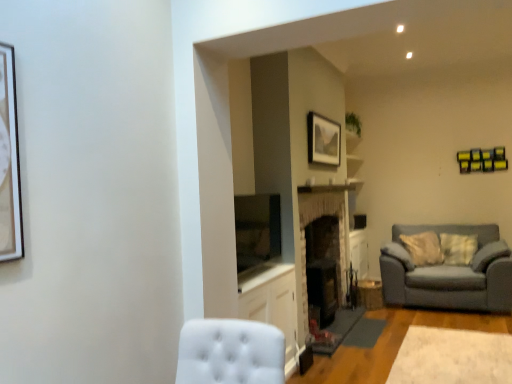
In order to face brick fireplace at center, which is the second fireplace from back to front, should I rotate leftwards or rightwards?

Turn right by 8.550 degrees to look at brick fireplace at center, which is the second fireplace from back to front.

Image resolution: width=512 pixels, height=384 pixels. What do you see at coordinates (272, 304) in the screenshot? I see `white glossy cabinet at center` at bounding box center [272, 304].

This screenshot has width=512, height=384. What do you see at coordinates (323, 140) in the screenshot? I see `matte wooden picture frame at upper center` at bounding box center [323, 140].

What do you see at coordinates (323, 266) in the screenshot? I see `dark stone fireplace at center, placed as the 2th fireplace when sorted from front to back` at bounding box center [323, 266].

What is the approximate height of dark stone fireplace at center, which is the first fireplace in back-to-front order?

dark stone fireplace at center, which is the first fireplace in back-to-front order, is 1.12 meters tall.

You are a GUI agent. You are given a task and a screenshot of the screen. Output one action in this format:
    pyautogui.click(x=<x>, y=<y>)
    Task: Click on the white plush rug at lower right
    
    Given the screenshot: What is the action you would take?
    pyautogui.click(x=452, y=357)

Does gray fabric couch at right appear on the right side of matte wooden picture frame at upper center?

Indeed, gray fabric couch at right is positioned on the right side of matte wooden picture frame at upper center.

Which is behind, point (433, 278) or point (319, 142)?

The point (433, 278) is behind.

Looking at this image, does gray fabric couch at right touch matte wooden picture frame at upper center?

No, gray fabric couch at right is not touching matte wooden picture frame at upper center.

Considering the sizes of objects gray fabric couch at right and matte wooden picture frame at upper center in the image provided, who is shorter, gray fabric couch at right or matte wooden picture frame at upper center?

matte wooden picture frame at upper center.

Which point is more forward, [475,367] or [492,280]?

The point [475,367] is in front.

Looking at this image, would you say white plush rug at lower right contains gray fabric couch at right?

That's incorrect, gray fabric couch at right is not inside white plush rug at lower right.

Is white plush rug at lower right positioned with its back to gray fabric couch at right?

white plush rug at lower right does not have its back to gray fabric couch at right.

Considering the sizes of brick fireplace at center, which is the second fireplace from back to front, and white glossy cabinet at center in the image, is brick fireplace at center, which is the second fireplace from back to front, bigger or smaller than white glossy cabinet at center?

brick fireplace at center, which is the second fireplace from back to front, is bigger than white glossy cabinet at center.

Find the location of `the 2nd fireplace directly above the white glossy cabinet at center (from a real-world perspective)`. the 2nd fireplace directly above the white glossy cabinet at center (from a real-world perspective) is located at coordinates (325, 215).

Could white glossy cabinet at center be considered to be inside brick fireplace at center, the 1th fireplace viewed from the front?

That's incorrect, white glossy cabinet at center is not inside brick fireplace at center, the 1th fireplace viewed from the front.

Looking at this image, can you confirm if brick fireplace at center, which is the second fireplace from back to front, is wider than white glossy cabinet at center?

Correct, the width of brick fireplace at center, which is the second fireplace from back to front, exceeds that of white glossy cabinet at center.

Is point (296, 346) farther from viewer compared to point (315, 187)?

No, (296, 346) is in front of (315, 187).

From a real-world perspective, is white glossy cabinet at center physically above brick fireplace at center, the 1th fireplace viewed from the front?

Incorrect, from a real-world perspective, white glossy cabinet at center is lower than brick fireplace at center, the 1th fireplace viewed from the front.

Find the location of `the 1st fireplace behind the white glossy cabinet at center`. the 1st fireplace behind the white glossy cabinet at center is located at coordinates (325, 215).

From the picture: Is gray fabric couch at right closer to camera compared to dark stone fireplace at center, which is the first fireplace in back-to-front order?

No, it is not.

Considering the sizes of objects gray fabric couch at right and dark stone fireplace at center, which is the first fireplace in back-to-front order, in the image provided, who is thinner, gray fabric couch at right or dark stone fireplace at center, which is the first fireplace in back-to-front order,?

dark stone fireplace at center, which is the first fireplace in back-to-front order, is thinner.

At what (x,y) coordinates should I click in order to perform the action: click on studio couch behind the dark stone fireplace at center, placed as the 2th fireplace when sorted from front to back. Please return your answer as a coordinate pair (x, y). The height and width of the screenshot is (384, 512). Looking at the image, I should click on click(x=449, y=273).

Are gray fabric couch at right and dark stone fireplace at center, which is the first fireplace in back-to-front order, located far from each other?

Yes, gray fabric couch at right is far from dark stone fireplace at center, which is the first fireplace in back-to-front order.

Would you say matte wooden picture frame at upper center is to the left or to the right of dark stone fireplace at center, which is the first fireplace in back-to-front order, in the picture?

From the image, it's evident that matte wooden picture frame at upper center is to the right of dark stone fireplace at center, which is the first fireplace in back-to-front order.

Is point (336, 149) closer to viewer compared to point (322, 288)?

No, (336, 149) is behind (322, 288).

Is matte wooden picture frame at upper center further to the viewer compared to dark stone fireplace at center, placed as the 2th fireplace when sorted from front to back?

No, matte wooden picture frame at upper center is in front of dark stone fireplace at center, placed as the 2th fireplace when sorted from front to back.

Looking at this image, from a real-world perspective, is matte wooden picture frame at upper center located beneath dark stone fireplace at center, placed as the 2th fireplace when sorted from front to back?

Incorrect, from a real-world perspective, matte wooden picture frame at upper center is higher than dark stone fireplace at center, placed as the 2th fireplace when sorted from front to back.

From the image's perspective, is dark stone fireplace at center, which is the first fireplace in back-to-front order, on top of brick fireplace at center, the 1th fireplace viewed from the front?

No.

Is brick fireplace at center, which is the second fireplace from back to front, surrounded by dark stone fireplace at center, which is the first fireplace in back-to-front order?

Definitely not — brick fireplace at center, which is the second fireplace from back to front, is not inside dark stone fireplace at center, which is the first fireplace in back-to-front order.

Considering the sizes of dark stone fireplace at center, which is the first fireplace in back-to-front order, and brick fireplace at center, the 1th fireplace viewed from the front, in the image, is dark stone fireplace at center, which is the first fireplace in back-to-front order, wider or thinner than brick fireplace at center, the 1th fireplace viewed from the front,?

dark stone fireplace at center, which is the first fireplace in back-to-front order, is thinner than brick fireplace at center, the 1th fireplace viewed from the front.

Are dark stone fireplace at center, which is the first fireplace in back-to-front order, and brick fireplace at center, the 1th fireplace viewed from the front, beside each other?

No, dark stone fireplace at center, which is the first fireplace in back-to-front order, is not in contact with brick fireplace at center, the 1th fireplace viewed from the front.

Locate an element on the screen. This screenshot has height=384, width=512. picture frame that appears on the left of gray fabric couch at right is located at coordinates (323, 140).

The height and width of the screenshot is (384, 512). Find the location of `plain that is below the gray fabric couch at right (from the image's perspective)`. plain that is below the gray fabric couch at right (from the image's perspective) is located at coordinates (452, 357).

When comparing their distances from white plush rug at lower right, does gray fabric couch at right or brick fireplace at center, which is the second fireplace from back to front, seem further?

Based on the image, brick fireplace at center, which is the second fireplace from back to front, appears to be further to white plush rug at lower right.

Estimate the real-world distances between objects in this image. Which object is closer to white plush rug at lower right, gray fabric couch at right or white glossy cabinet at center?

Among the two, gray fabric couch at right is located nearer to white plush rug at lower right.

Which object lies nearer to the anchor point gray fabric couch at right, white glossy cabinet at center or matte wooden picture frame at upper center?

Among the two, matte wooden picture frame at upper center is located nearer to gray fabric couch at right.

Looking at the image, which one is located further to brick fireplace at center, which is the second fireplace from back to front, white glossy cabinet at center or matte wooden picture frame at upper center?

The object further to brick fireplace at center, which is the second fireplace from back to front, is white glossy cabinet at center.

Based on their spatial positions, is brick fireplace at center, the 1th fireplace viewed from the front, or matte wooden picture frame at upper center further from gray fabric couch at right?

matte wooden picture frame at upper center is further to gray fabric couch at right.

Considering their positions, is dark stone fireplace at center, which is the first fireplace in back-to-front order, positioned closer to white glossy cabinet at center than white plush rug at lower right?

dark stone fireplace at center, which is the first fireplace in back-to-front order, lies closer to white glossy cabinet at center than the other object.

Which object lies further to the anchor point brick fireplace at center, the 1th fireplace viewed from the front, dark stone fireplace at center, which is the first fireplace in back-to-front order, or gray fabric couch at right?

gray fabric couch at right is further to brick fireplace at center, the 1th fireplace viewed from the front.

Which object lies further to the anchor point matte wooden picture frame at upper center, white plush rug at lower right or brick fireplace at center, the 1th fireplace viewed from the front?

white plush rug at lower right lies further to matte wooden picture frame at upper center than the other object.

The width and height of the screenshot is (512, 384). I want to click on picture frame between white glossy cabinet at center and gray fabric couch at right in the horizontal direction, so click(323, 140).

Locate an element on the screen. fireplace between dark stone fireplace at center, which is the first fireplace in back-to-front order, and gray fabric couch at right, in the horizontal direction is located at coordinates (325, 215).

The height and width of the screenshot is (384, 512). I want to click on plain between white glossy cabinet at center and gray fabric couch at right in the horizontal direction, so (452, 357).

Image resolution: width=512 pixels, height=384 pixels. Identify the location of fireplace positioned between white glossy cabinet at center and dark stone fireplace at center, which is the first fireplace in back-to-front order, from near to far. (325, 215).